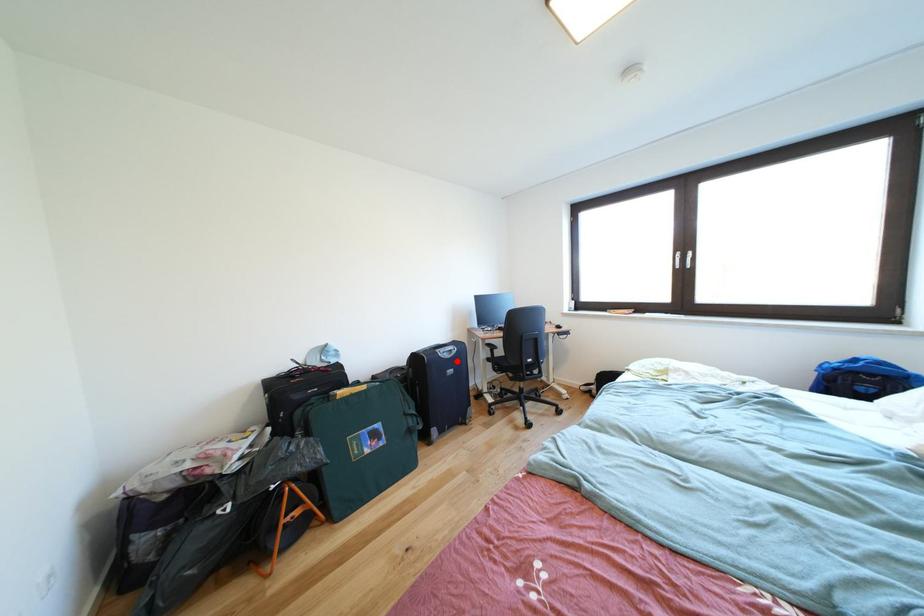
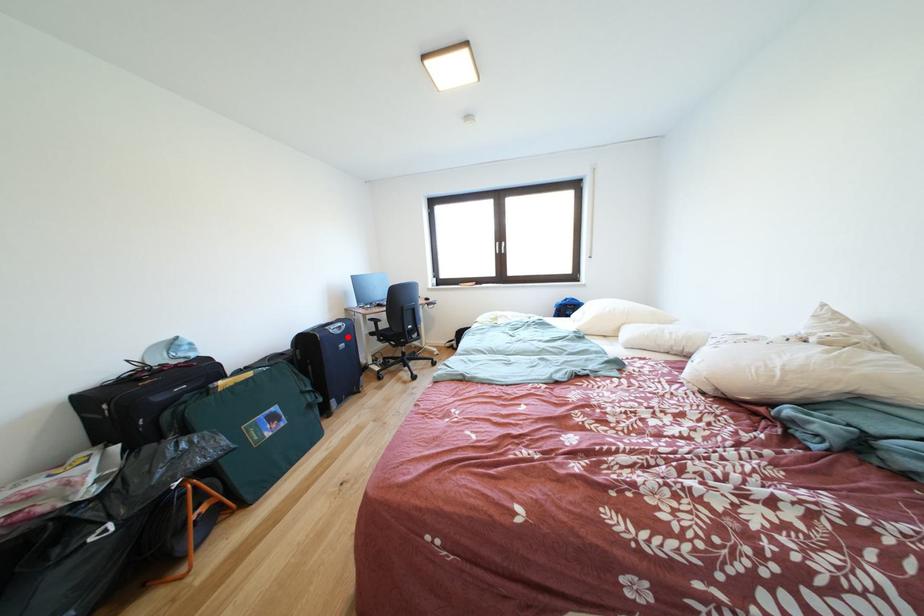
I am providing you with two images of the same scene from different viewpoints. A red point is marked on the first image and another point is marked on the second image. Does the point marked in image1 correspond to the same location as the one in image2?

Yes